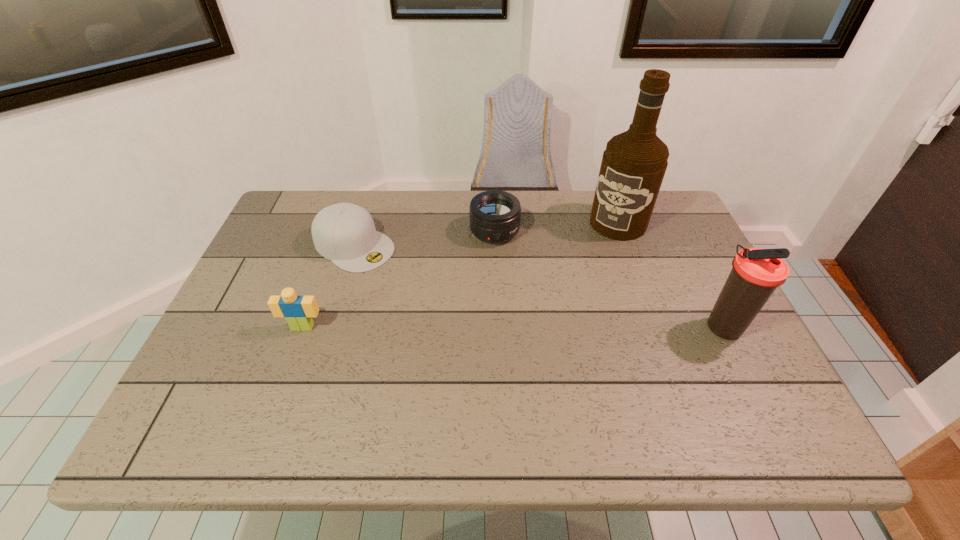
Identify the location of free space on the desktop that is between the Lego and the fourth shortest object and is positioned on the front-facing side of the cap. (483, 327).

What are the coordinates of `vacant spot on the desktop that is between the third tallest object and the fourth shortest object and is positioned on the side of the third object from left to right with brand markings and control switches` in the screenshot? It's located at coord(529,327).

Where is `free space on the desktop that is between the Lego and the second tallest object and is positioned on the label of the alcohol`? The height and width of the screenshot is (540, 960). free space on the desktop that is between the Lego and the second tallest object and is positioned on the label of the alcohol is located at coordinates (541, 327).